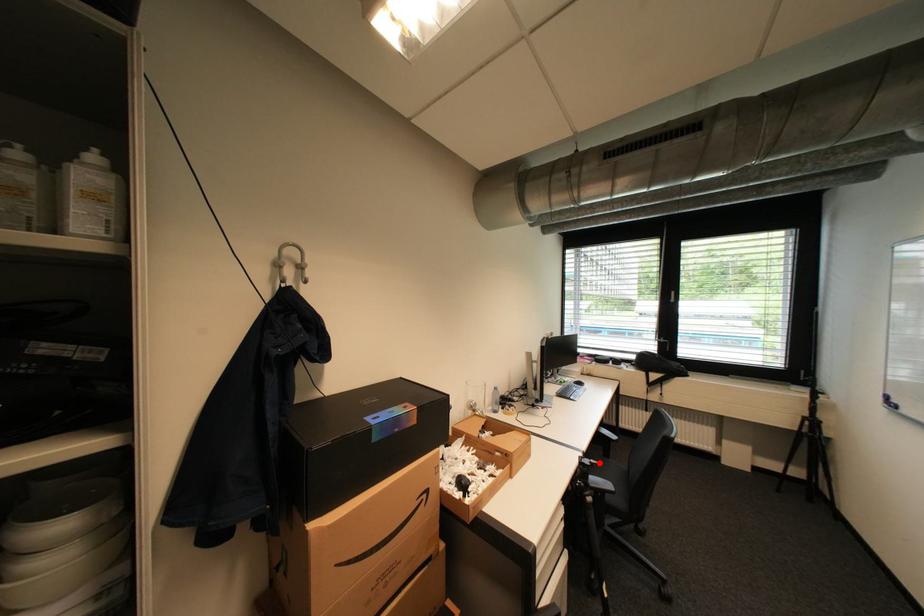
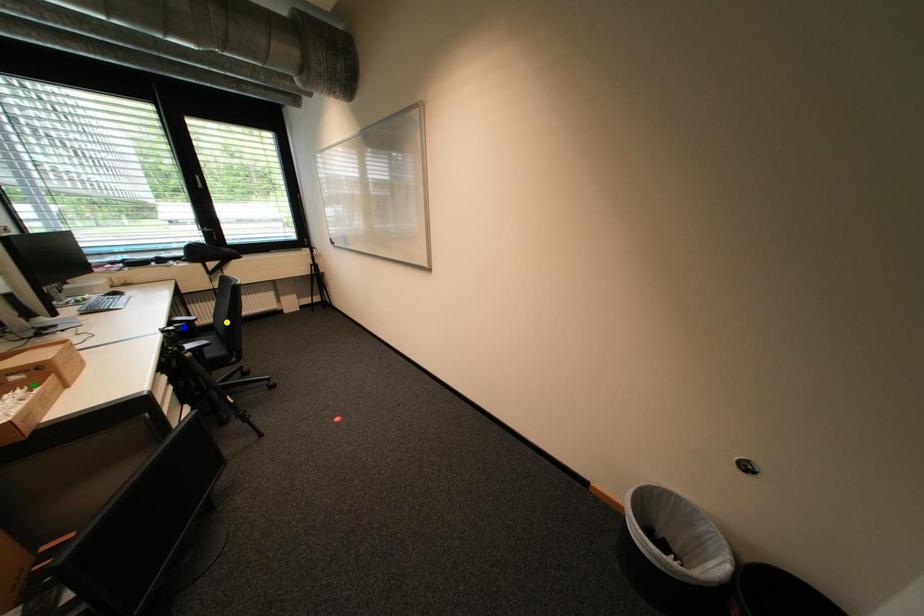
Question: I am providing you with two images of the same scene from different viewpoints. A red point is marked on the first image. You are given multiple points on the second image. Can you choose the point in image 2 that corresponds to the point in image 1?

Choices:
 (A) blue point
 (B) green point
 (C) yellow point

Answer: (A)